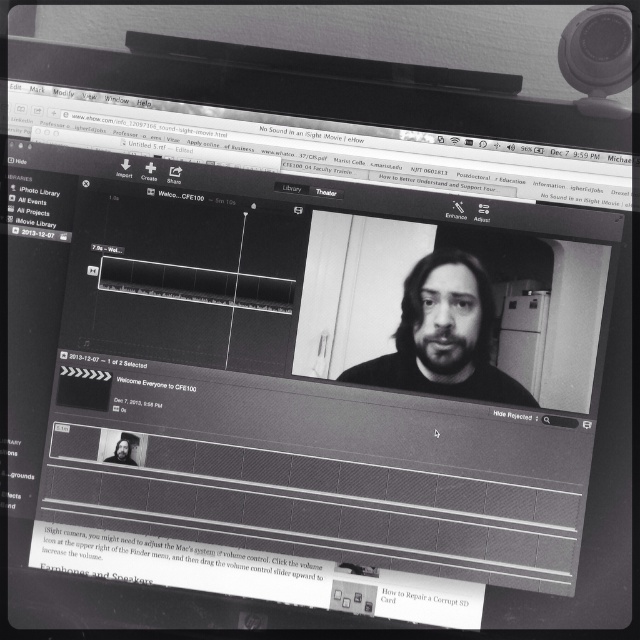
You are a video editor reviewing a video call recording. You notice two objects in the frame, the black matte face at center and the dark hair man at center. Which one is positioned to the right side of the other?

The black matte face at center is positioned to the right of the dark hair man at center according to the description.